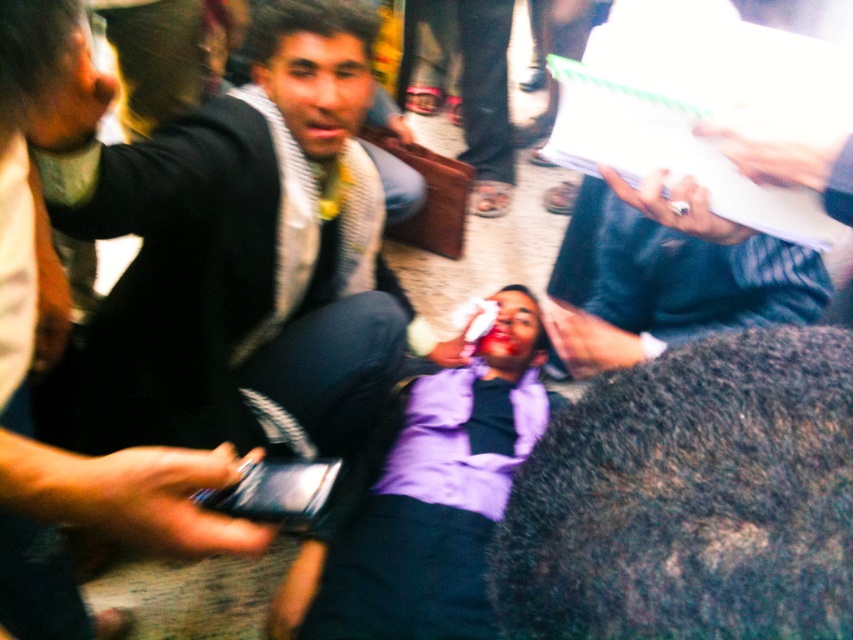
You are a photographer who just took a photo of this chaotic scene. In your photo, you need to ensure that the matte black jacket at center and the white paper at upper right are both visible. Based on their positions, which object is located more to the left?

The matte black jacket at center is positioned on the left side of white paper at upper right, so it is more to the left.

You are a photographer who needs to adjust the focus of your camera to capture both the matte black jacket at center and the white paper at upper right clearly. Given their relative sizes in the frame, which object should you focus on first to ensure proper depth of field?

The matte black jacket at center has a greater height compared to the white paper at upper right, so you should focus on the matte black jacket at center first to ensure proper depth of field.

Based on the coordinates provided in the scene, where exactly is the matte black jacket at center located?

The matte black jacket at center is located at point coordinates of 0.394 on the x axis and 0.286 on the y axis.